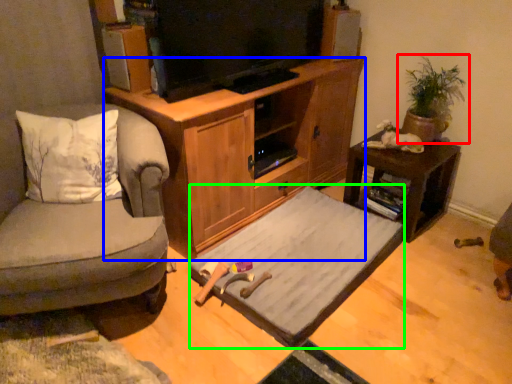
Question: Which is farther away from houseplant (highlighted by a red box)? cabinetry (highlighted by a blue box) or bed frame (highlighted by a green box)?

Choices:
 (A) cabinetry
 (B) bed frame

Answer: (B)